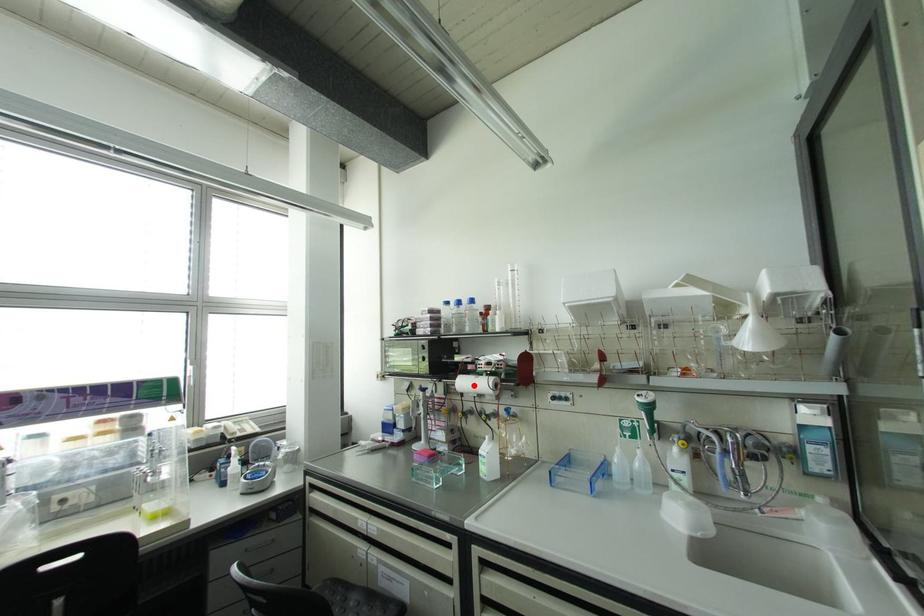
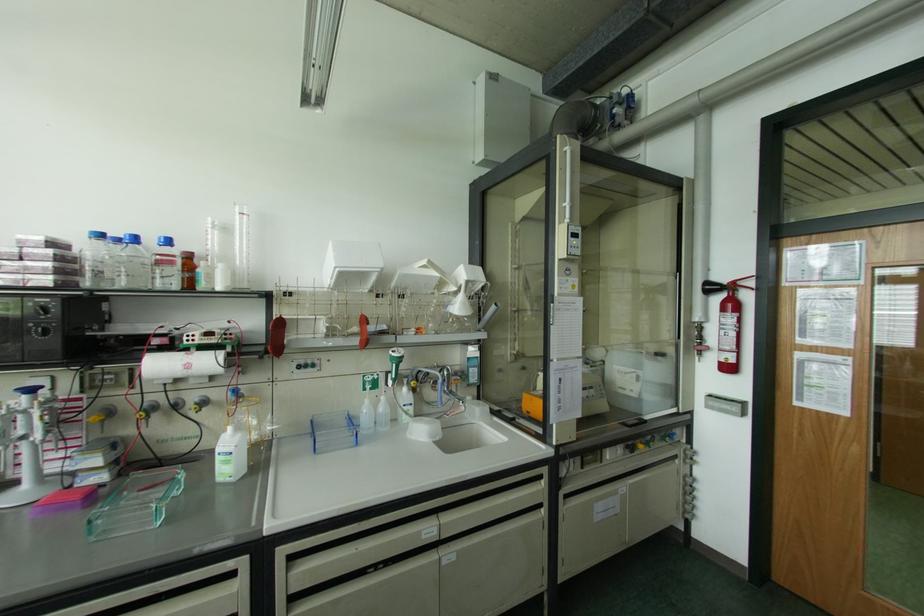
The point at the highlighted location is marked in the first image. Where is the corresponding point in the second image?

(188, 366)